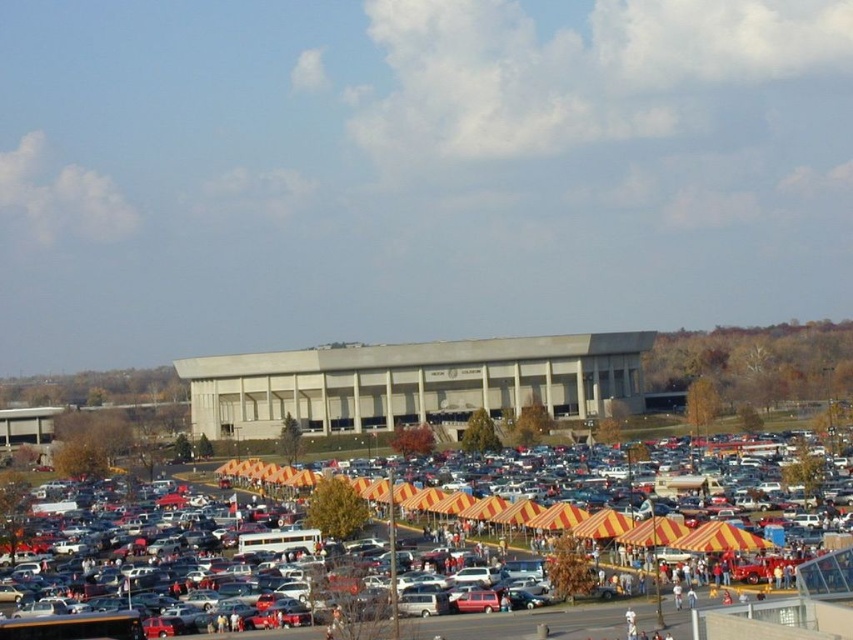
You are standing in the parking lot and want to find the beige concrete building at center. Which direction should you look to see it from the yellow striped tents at center?

The beige concrete building at center is located above the yellow striped tents at center, so you should look upward from the yellow striped tents at center to see it.

Consider the image. You are standing at the entrance of the fair, which is located at point coordinates of 0,0. The main stage is at point coordinates of 1,1. You want to go from the entrance to the main stage. Is the yellow striped tents at center in your way?

The yellow striped tents at center are located at point coordinates of (398, 556). Since the entrance is at (0, 0) and the main stage is at (852, 639), the tents are positioned along the path between these two points, so they would be in the way.

You are standing at the center of the parking lot and see the point marked at coordinates (398,556). What object is located at that point?

The point at coordinates (398,556) indicates yellow striped tents at center.